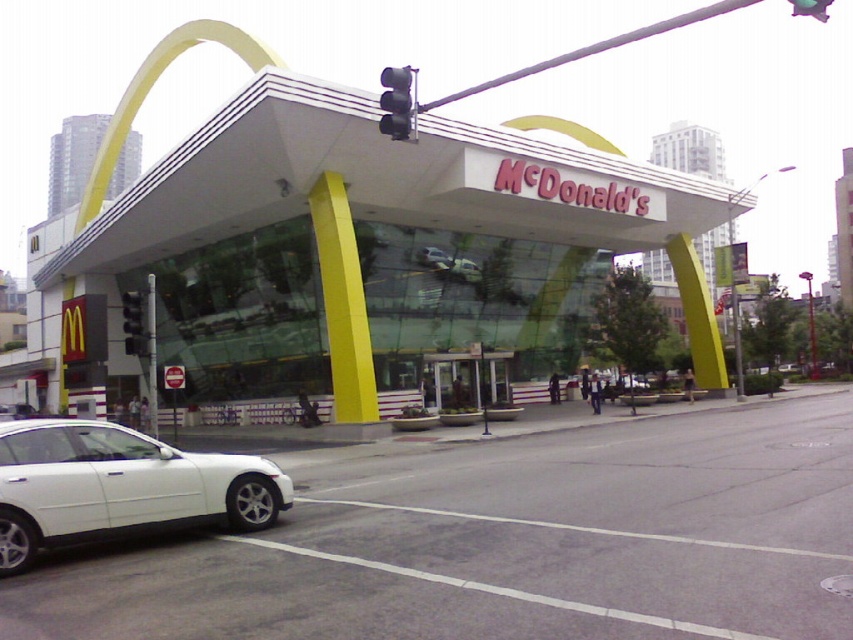
Question: Considering the relative positions of white glossy car at lower left and metallic silver car at center in the image provided, where is white glossy car at lower left located with respect to metallic silver car at center?

Choices:
 (A) below
 (B) above

Answer: (A)

Question: Which point is closer to the camera taking this photo?

Choices:
 (A) (209, 456)
 (B) (138, 353)

Answer: (A)

Question: Is the position of black plastic traffic light at left less distant than that of metallic silver car at center?

Choices:
 (A) no
 (B) yes

Answer: (B)

Question: Is matte yellow mcdonald's at center to the left of metallic silver car at center from the viewer's perspective?

Choices:
 (A) no
 (B) yes

Answer: (B)

Question: Which point is farther to the camera?

Choices:
 (A) (248, 92)
 (B) (236, 474)
 (C) (132, 352)
 (D) (380, 116)

Answer: (D)

Question: Which point is farther to the camera?

Choices:
 (A) (407, 96)
 (B) (178, 230)
 (C) (141, 332)
 (D) (433, 250)

Answer: (D)